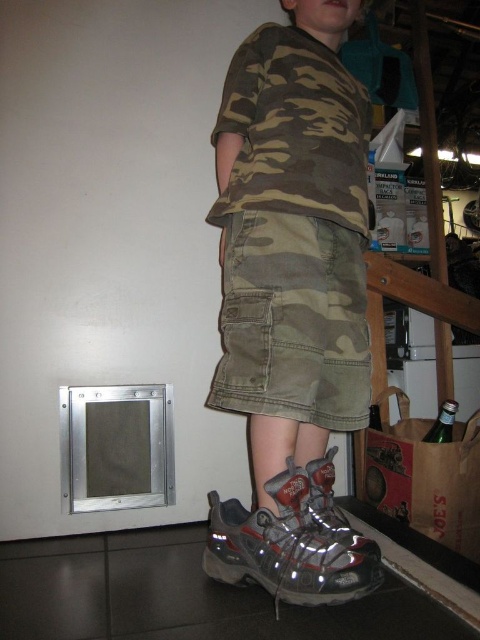
Is point (324, 112) less distant than point (290, 525)?

No, (324, 112) is further to viewer.

Does camouflage fabric shirt at center appear on the left side of metallic gray shoe at lower center?

Incorrect, camouflage fabric shirt at center is not on the left side of metallic gray shoe at lower center.

What do you see at coordinates (291, 298) in the screenshot?
I see `camouflage fabric shirt at center` at bounding box center [291, 298].

Locate an element on the screen. The width and height of the screenshot is (480, 640). camouflage fabric shirt at center is located at coordinates (291, 298).